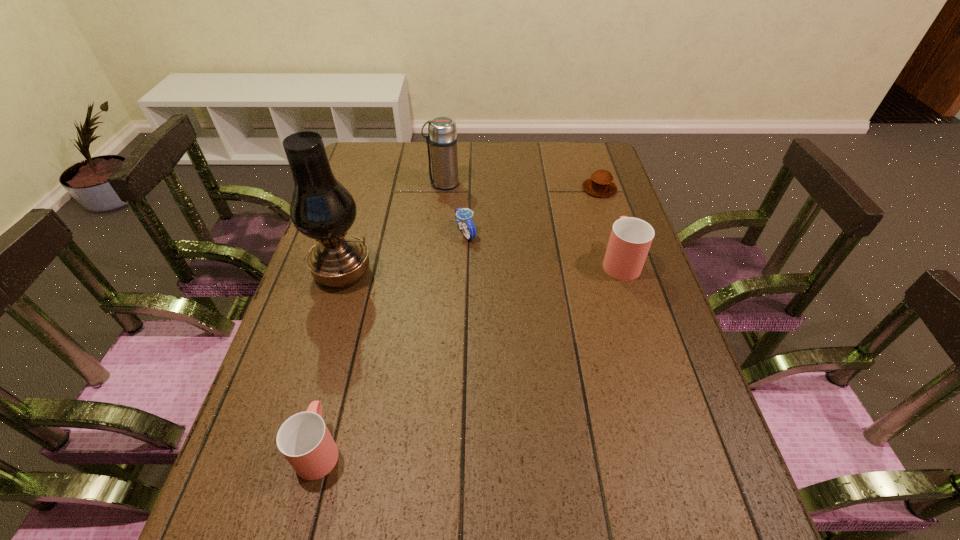
Where is `empty space between the thermos bottle and the nearer cup`? The width and height of the screenshot is (960, 540). empty space between the thermos bottle and the nearer cup is located at coordinates (x=381, y=316).

The image size is (960, 540). Identify the location of free space between the watch and the tallest object. (404, 253).

Where is `the second closest object to the muffin`? the second closest object to the muffin is located at coordinates (462, 215).

What are the coordinates of `object that is the second closest to the watch` in the screenshot? It's located at (321, 208).

This screenshot has width=960, height=540. I want to click on vacant space that satisfies the following two spatial constraints: 1. on the side of the nearest object with the handle; 2. on the right side of the muffin, so click(x=386, y=188).

I want to click on vacant region that satisfies the following two spatial constraints: 1. with a handle on the side of the muffin; 2. on the right side of the fifth shortest object, so click(443, 188).

The width and height of the screenshot is (960, 540). What are the coordinates of `vacant region that satisfies the following two spatial constraints: 1. on the side of the nearest object with the handle; 2. on the left side of the watch` in the screenshot? It's located at (374, 233).

Identify the location of free space that satisfies the following two spatial constraints: 1. with a handle on the side of the fifth shortest object; 2. on the left side of the watch. (438, 233).

You are a GUI agent. You are given a task and a screenshot of the screen. Output one action in this format:
    pyautogui.click(x=<x>, y=<y>)
    Task: Click on the blank space that satisfies the following two spatial constraints: 1. with a handle on the side of the thermos bottle; 2. on the side of the third tallest object with the handle
    This screenshot has width=960, height=540.
    Given the screenshot: What is the action you would take?
    (x=435, y=261)

Locate an element on the screen. The width and height of the screenshot is (960, 540). blank space that satisfies the following two spatial constraints: 1. with a handle on the side of the watch; 2. on the left side of the second tallest object is located at coordinates (438, 233).